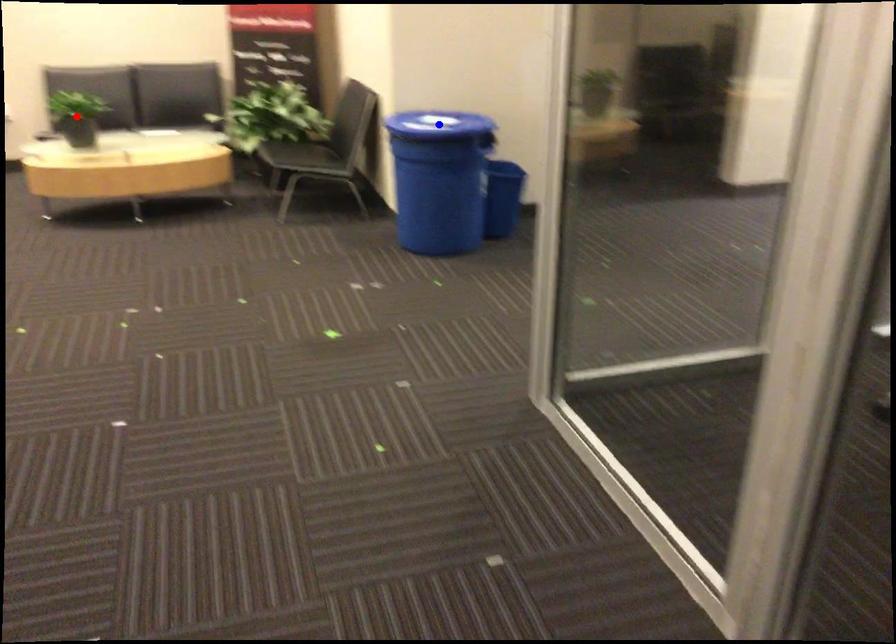
Question: Two points are marked on the image. Which point is closer to the camera?

Choices:
 (A) Blue point is closer.
 (B) Red point is closer.

Answer: (A)